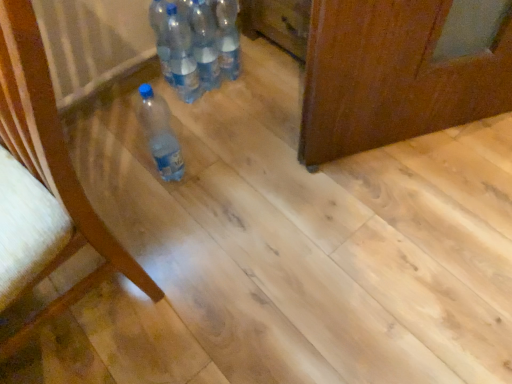
Question: Can you confirm if matte wood chair at left is thinner than clear plastic bottle at center, the 3th bottle viewed from the top?

Choices:
 (A) yes
 (B) no

Answer: (B)

Question: Is matte wood chair at left to the right of clear plastic bottle at center, which is counted as the second bottle, starting from the bottom, from the viewer's perspective?

Choices:
 (A) yes
 (B) no

Answer: (B)

Question: Can you confirm if matte wood chair at left is positioned to the left of clear plastic bottle at center, the 3th bottle viewed from the top?

Choices:
 (A) yes
 (B) no

Answer: (A)

Question: Can you confirm if matte wood chair at left is shorter than clear plastic bottle at center, which is counted as the second bottle, starting from the bottom?

Choices:
 (A) no
 (B) yes

Answer: (A)

Question: From a real-world perspective, is matte wood chair at left positioned over clear plastic bottle at center, which is counted as the second bottle, starting from the bottom, based on gravity?

Choices:
 (A) no
 (B) yes

Answer: (B)

Question: Based on their positions, is clear plastic bottle at center, the 3th bottle viewed from the top, located to the left or right of translucent plastic bottles at center, which is the 2th bottle in top-to-bottom order?

Choices:
 (A) right
 (B) left

Answer: (B)

Question: Considering their positions, is clear plastic bottle at center, the 3th bottle viewed from the top, located in front of or behind translucent plastic bottles at center, the third bottle positioned from the bottom?

Choices:
 (A) behind
 (B) front

Answer: (B)

Question: From a real-world perspective, is clear plastic bottle at center, which is counted as the second bottle, starting from the bottom, positioned above or below translucent plastic bottles at center, which is the 2th bottle in top-to-bottom order?

Choices:
 (A) above
 (B) below

Answer: (B)

Question: In terms of width, does clear plastic bottle at center, the 3th bottle viewed from the top, look wider or thinner when compared to translucent plastic bottles at center, the third bottle positioned from the bottom?

Choices:
 (A) wide
 (B) thin

Answer: (B)

Question: Is clear plastic bottle at center, the 3th bottle viewed from the top, taller or shorter than matte wood chair at left?

Choices:
 (A) short
 (B) tall

Answer: (A)

Question: Do you think clear plastic bottle at center, which is counted as the second bottle, starting from the bottom, is within matte wood chair at left, or outside of it?

Choices:
 (A) outside
 (B) inside

Answer: (A)

Question: In terms of width, does clear plastic bottle at center, the 3th bottle viewed from the top, look wider or thinner when compared to matte wood chair at left?

Choices:
 (A) wide
 (B) thin

Answer: (B)

Question: Considering the positions of clear plastic bottle at center, the 3th bottle viewed from the top, and matte wood chair at left in the image, is clear plastic bottle at center, the 3th bottle viewed from the top, bigger or smaller than matte wood chair at left?

Choices:
 (A) big
 (B) small

Answer: (B)

Question: Based on their sizes in the image, would you say matte wood chair at left is bigger or smaller than translucent plastic bottle at lower left, which is counted as the 4th bottle, starting from the top?

Choices:
 (A) big
 (B) small

Answer: (A)

Question: In the image, is matte wood chair at left positioned in front of or behind translucent plastic bottle at lower left, which is counted as the 4th bottle, starting from the top?

Choices:
 (A) front
 (B) behind

Answer: (A)